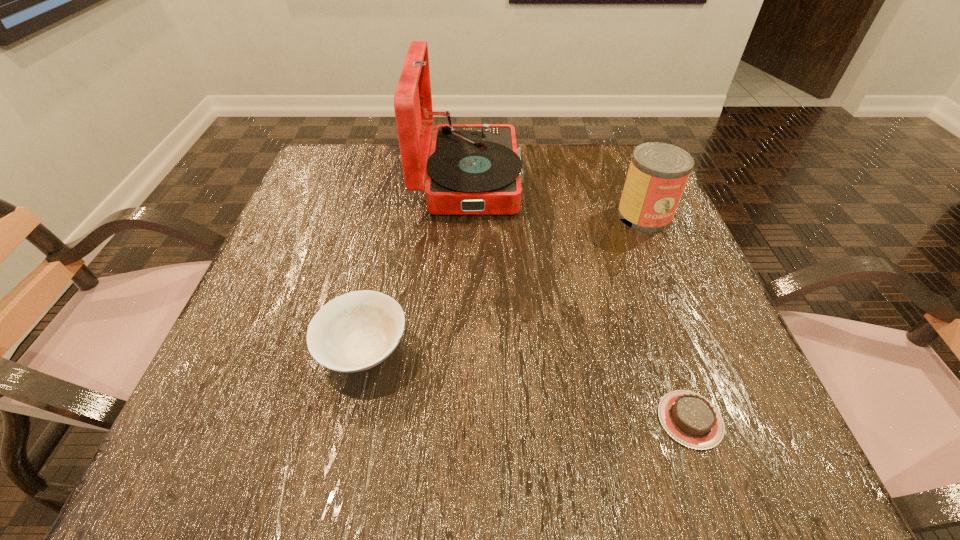
You are a GUI agent. You are given a task and a screenshot of the screen. Output one action in this format:
    pyautogui.click(x=<x>, y=<y>)
    Task: Click on the free spot that satisfies the following two spatial constraints: 1. on the front-facing side of the phonograph_record; 2. on the front side of the third tallest object
    This screenshot has width=960, height=540.
    Given the screenshot: What is the action you would take?
    pyautogui.click(x=463, y=350)

Identify the location of free region that satisfies the following two spatial constraints: 1. on the front-facing side of the third shortest object; 2. on the right side of the phonograph_record. The image size is (960, 540). (468, 215).

At what (x,y) coordinates should I click in order to perform the action: click on vacant space that satisfies the following two spatial constraints: 1. on the front-facing side of the shortest object; 2. on the left side of the phonograph_record. Please return your answer as a coordinate pair (x, y). The image size is (960, 540). Looking at the image, I should click on (461, 420).